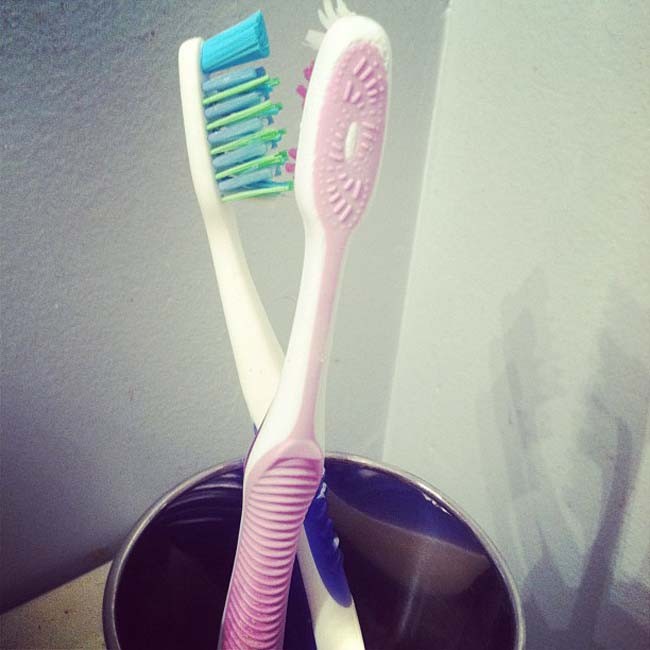
You are a GUI agent. You are given a task and a screenshot of the screen. Output one action in this format:
    pyautogui.click(x=<x>, y=<y>)
    Task: Click on the white popcorn wall
    This screenshot has height=650, width=650.
    Given the screenshot: What is the action you would take?
    pyautogui.click(x=88, y=198), pyautogui.click(x=556, y=205)